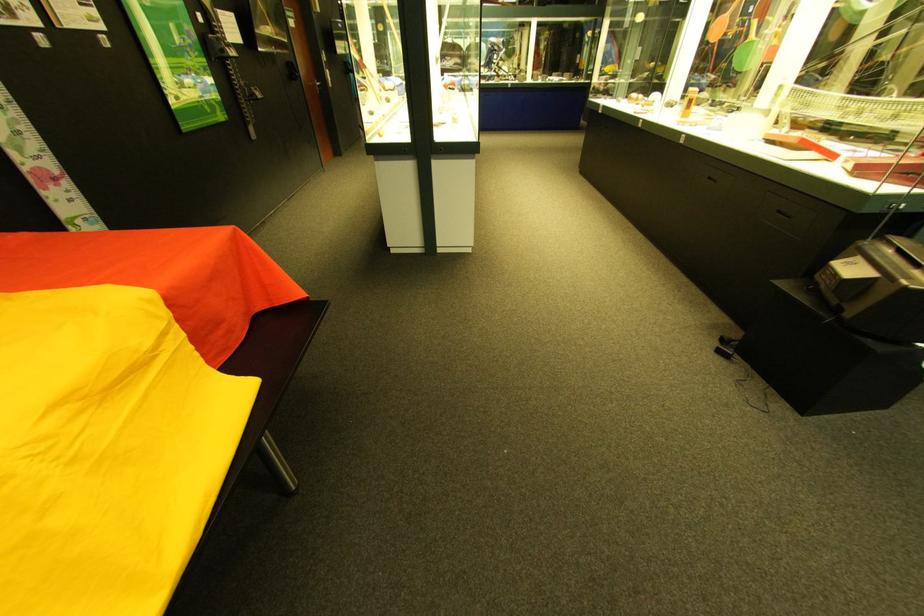
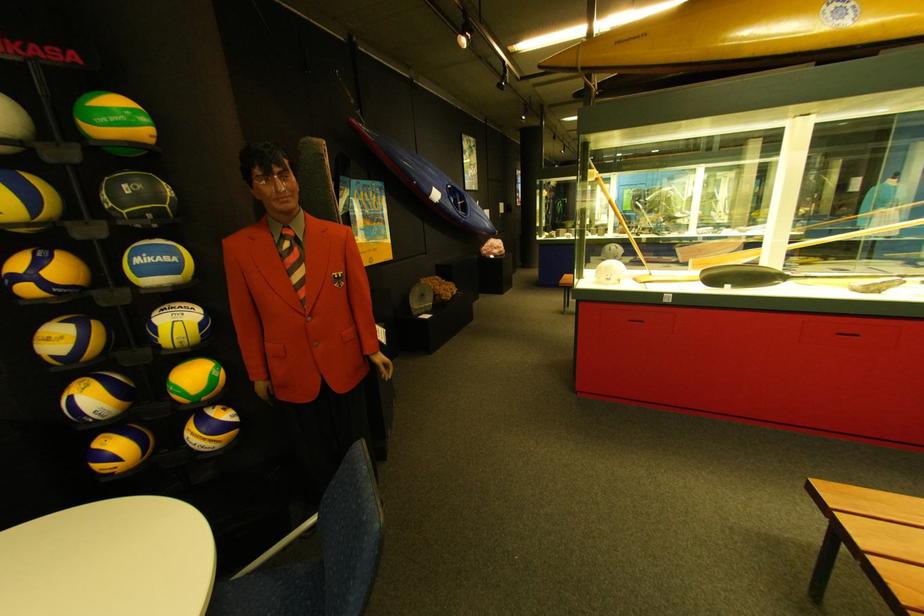
Question: I am providing you with two images of the same scene from different viewpoints. Which of the following objects are not visible in image2?

Choices:
 (A) black drawer pull
 (B) blue and yellow volleyball
 (C) black volleyball
 (D) orange plant pot

Answer: (A)